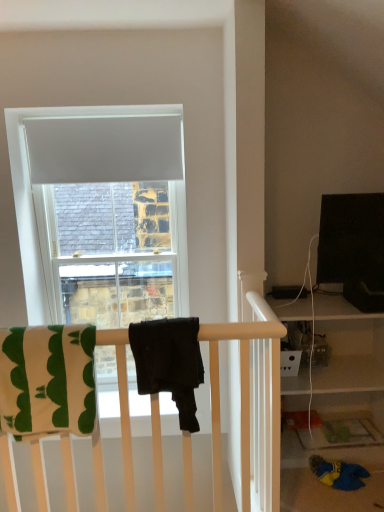
Question: Is black matte towel at center, the 1th beach towel in the right-to-left sequence, to the right of white matte curtain at upper center from the viewer's perspective?

Choices:
 (A) yes
 (B) no

Answer: (A)

Question: Is black matte towel at center, the 2th beach towel when ordered from left to right, next to white matte curtain at upper center?

Choices:
 (A) no
 (B) yes

Answer: (A)

Question: Can you confirm if black matte towel at center, the 1th beach towel in the right-to-left sequence, is taller than white matte curtain at upper center?

Choices:
 (A) yes
 (B) no

Answer: (A)

Question: Does black matte towel at center, the 2th beach towel when ordered from left to right, have a lesser width compared to white matte curtain at upper center?

Choices:
 (A) no
 (B) yes

Answer: (A)

Question: Is black matte towel at center, the 1th beach towel in the right-to-left sequence, facing away from white matte curtain at upper center?

Choices:
 (A) yes
 (B) no

Answer: (B)

Question: Choose the correct answer: Is white matte curtain at upper center inside black matte towel at center, the 1th beach towel in the right-to-left sequence, or outside it?

Choices:
 (A) outside
 (B) inside

Answer: (A)

Question: From a real-world perspective, is white matte curtain at upper center physically located above or below black matte towel at center, the 2th beach towel when ordered from left to right?

Choices:
 (A) below
 (B) above

Answer: (B)

Question: Looking at their shapes, would you say white matte curtain at upper center is wider or thinner than black matte towel at center, the 2th beach towel when ordered from left to right?

Choices:
 (A) wide
 (B) thin

Answer: (B)

Question: Is point (41, 167) positioned closer to the camera than point (188, 389)?

Choices:
 (A) closer
 (B) farther

Answer: (B)

Question: Considering the positions of green cotton beach towel at left, placed as the first beach towel when sorted from left to right, and white matte curtain at upper center in the image, is green cotton beach towel at left, placed as the first beach towel when sorted from left to right, taller or shorter than white matte curtain at upper center?

Choices:
 (A) short
 (B) tall

Answer: (B)

Question: Do you think green cotton beach towel at left, placed as the first beach towel when sorted from left to right, is within white matte curtain at upper center, or outside of it?

Choices:
 (A) outside
 (B) inside

Answer: (A)

Question: Is point (36, 358) positioned closer to the camera than point (92, 143)?

Choices:
 (A) closer
 (B) farther

Answer: (A)

Question: Looking at their shapes, would you say green cotton beach towel at left, the second beach towel when ordered from right to left, is wider or thinner than white matte curtain at upper center?

Choices:
 (A) thin
 (B) wide

Answer: (B)

Question: From a real-world perspective, is white matte curtain at upper center above or below green cotton beach towel at left, the second beach towel when ordered from right to left?

Choices:
 (A) below
 (B) above

Answer: (B)

Question: Is white matte curtain at upper center taller or shorter than green cotton beach towel at left, the second beach towel when ordered from right to left?

Choices:
 (A) tall
 (B) short

Answer: (B)